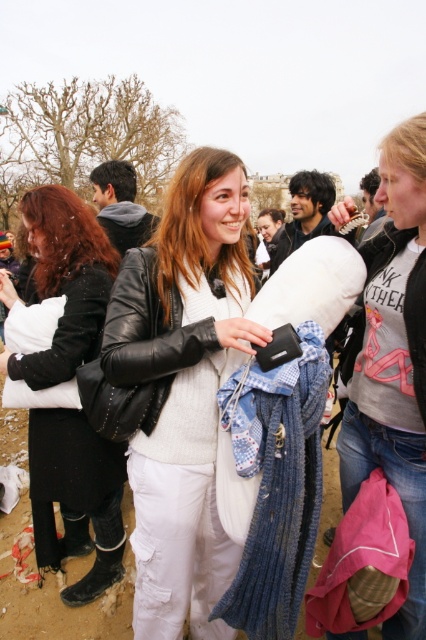
Can you confirm if matte black jacket at center is bigger than white fluffy pillow at left?

No, matte black jacket at center is not bigger than white fluffy pillow at left.

Can you confirm if matte black jacket at center is positioned to the left of white fluffy pillow at left?

In fact, matte black jacket at center is to the right of white fluffy pillow at left.

Between point (187, 497) and point (51, 534), which one is positioned behind?

Positioned behind is point (51, 534).

What are the coordinates of `matte black jacket at center` in the screenshot? It's located at (183, 388).